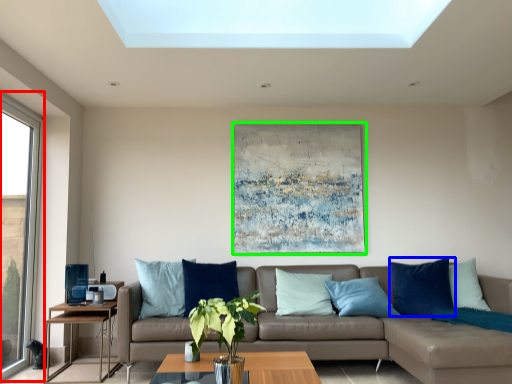
Question: Estimate the real-world distances between objects in this image. Which object is farther from window (highlighted by a red box), pillow (highlighted by a blue box) or picture frame (highlighted by a green box)?

Choices:
 (A) pillow
 (B) picture frame

Answer: (A)